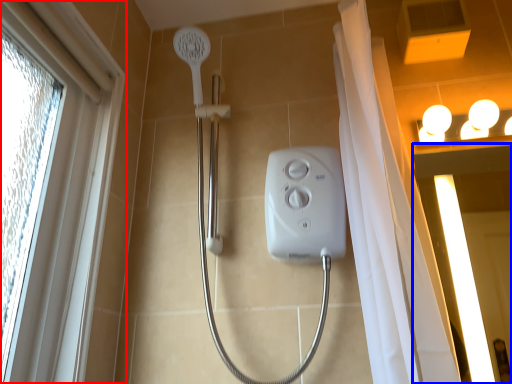
Question: Which of the following is the closest to the observer, window (highlighted by a red box) or screen door (highlighted by a blue box)?

Choices:
 (A) window
 (B) screen door

Answer: (A)